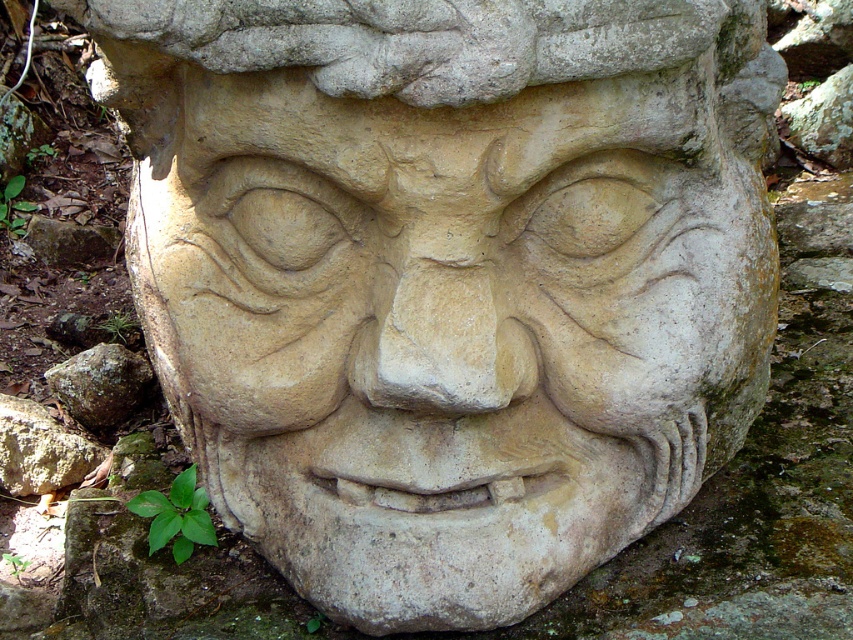
Question: Which object appears closest to the camera in this image?

Choices:
 (A) brown rough rock at lower left
 (B) gray stone at lower left

Answer: (B)

Question: Can you confirm if gray stone at lower left is positioned above brown rough rock at lower left?

Choices:
 (A) yes
 (B) no

Answer: (B)

Question: Can you confirm if gray stone at lower left is smaller than brown rough rock at lower left?

Choices:
 (A) yes
 (B) no

Answer: (A)

Question: Which of the following is the farthest from the observer?

Choices:
 (A) gray stone at lower left
 (B) brown rough rock at lower left

Answer: (B)

Question: Which object appears closest to the camera in this image?

Choices:
 (A) gray stone at lower left
 (B) brown rough rock at lower left

Answer: (A)

Question: Can you confirm if gray stone at lower left is positioned to the left of brown rough rock at lower left?

Choices:
 (A) no
 (B) yes

Answer: (B)